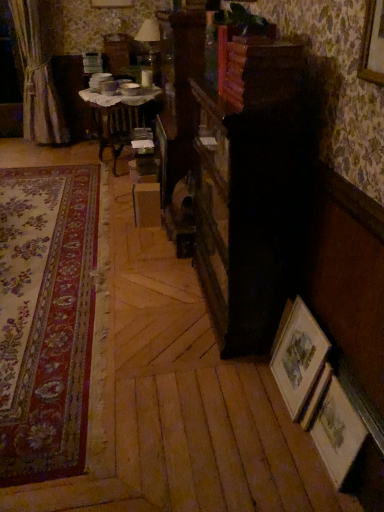
What do you see at coordinates (120, 111) in the screenshot? The height and width of the screenshot is (512, 384). I see `wooden table at center` at bounding box center [120, 111].

What do you see at coordinates (149, 44) in the screenshot?
I see `matte white lampshade at upper center` at bounding box center [149, 44].

The image size is (384, 512). Find the location of `wooden picture frame at lower right, marked as the 1th picture frame in a right-to-left arrangement`. wooden picture frame at lower right, marked as the 1th picture frame in a right-to-left arrangement is located at coordinates (337, 433).

I want to click on wooden table at center, so click(120, 111).

Consider the image. Which point is more forward, [37,111] or [94,212]?

The point [94,212] is in front.

Is silky beige curtain at left facing towards floral carpet at left?

Yes, silky beige curtain at left faces towards floral carpet at left.

Are silky beige curtain at left and floral carpet at left making contact?

No, silky beige curtain at left is not touching floral carpet at left.

Which is behind, matte white lampshade at upper center or wooden at upper center?

matte white lampshade at upper center.

I want to click on shelf below the matte white lampshade at upper center (from the image's perspective), so click(257, 68).

How distant is matte white lampshade at upper center from wooden at upper center?

They are 8.51 feet apart.

Looking at their sizes, would you say matte white lampshade at upper center is wider or thinner than wooden at upper center?

Clearly, matte white lampshade at upper center has more width compared to wooden at upper center.

Which object is positioned more to the left, wooden picture frame at lower right, marked as the 1th picture frame in a right-to-left arrangement, or silky beige curtain at left?

silky beige curtain at left is more to the left.

Is point (318, 440) farther from camera compared to point (36, 128)?

That is False.

In the scene shown: Relative to silky beige curtain at left, is wooden picture frame at lower right, marked as the 1th picture frame in a right-to-left arrangement, in front or behind?

In the image, wooden picture frame at lower right, marked as the 1th picture frame in a right-to-left arrangement, appears in front of silky beige curtain at left.

Is wooden picture frame at lower right, marked as the 1th picture frame in a right-to-left arrangement, inside or outside of matte white lampshade at upper center?

wooden picture frame at lower right, marked as the 1th picture frame in a right-to-left arrangement, is not enclosed by matte white lampshade at upper center.

From the image's perspective, would you say wooden picture frame at lower right, marked as the 1th picture frame in a right-to-left arrangement, is positioned over matte white lampshade at upper center?

No.

From the picture: From a real-world perspective, between wooden picture frame at lower right, which is the 2th picture frame in left-to-right order, and matte white lampshade at upper center, who is vertically higher?

matte white lampshade at upper center.

Between point (356, 412) and point (146, 49), which one is positioned behind?

The point (146, 49) is behind.

Is silky beige curtain at left located within wooden at upper center?

No.

Who is shorter, wooden at upper center or silky beige curtain at left?

With less height is wooden at upper center.

From the image's perspective, between wooden at upper center and silky beige curtain at left, which one is located above?

silky beige curtain at left, from the image's perspective.

Does wooden at upper center have a larger size compared to wooden table at center?

No.

Is wooden table at center completely or partially inside wooden at upper center?

No, wooden table at center is not a part of wooden at upper center.

Is wooden framed print at lower right, which appears as the 2th picture frame when viewed from the right, turned away from matte white lampshade at upper center?

No, wooden framed print at lower right, which appears as the 2th picture frame when viewed from the right, is not facing away from matte white lampshade at upper center.

From a real-world perspective, is wooden framed print at lower right, which appears as the 1th picture frame when viewed from the left, on top of matte white lampshade at upper center?

Incorrect, from a real-world perspective, wooden framed print at lower right, which appears as the 1th picture frame when viewed from the left, is lower than matte white lampshade at upper center.

Is point (303, 400) less distant than point (151, 32)?

Yes, point (303, 400) is closer to viewer.

Does wooden framed print at lower right, which appears as the 2th picture frame when viewed from the right, come in front of matte white lampshade at upper center?

Yes, wooden framed print at lower right, which appears as the 2th picture frame when viewed from the right, is closer to the camera.

I want to click on plain in front of the silky beige curtain at left, so click(x=46, y=319).

You are a GUI agent. You are given a task and a screenshot of the screen. Output one action in this format:
    pyautogui.click(x=<x>, y=<y>)
    Task: Click on the shelf positioned vertically above the matte white lampshade at upper center (from a real-world perspective)
    The width and height of the screenshot is (384, 512).
    Given the screenshot: What is the action you would take?
    pyautogui.click(x=257, y=68)

From the image, which object appears to be nearer to floral carpet at left, silky beige curtain at left or wooden picture frame at lower right, marked as the 1th picture frame in a right-to-left arrangement?

wooden picture frame at lower right, marked as the 1th picture frame in a right-to-left arrangement, lies closer to floral carpet at left than the other object.

In the scene shown: When comparing their distances from wooden picture frame at lower right, marked as the 1th picture frame in a right-to-left arrangement, does wooden table at center or wooden at upper center seem closer?

wooden at upper center.

Based on their spatial positions, is silky beige curtain at left or wooden at upper center further from matte white lampshade at upper center?

wooden at upper center.

Estimate the real-world distances between objects in this image. Which object is closer to wooden framed print at lower right, which appears as the 2th picture frame when viewed from the right, matte white lampshade at upper center or silky beige curtain at left?

matte white lampshade at upper center.

Estimate the real-world distances between objects in this image. Which object is closer to wooden picture frame at lower right, marked as the 1th picture frame in a right-to-left arrangement, floral carpet at left or wooden table at center?

Among the two, floral carpet at left is located nearer to wooden picture frame at lower right, marked as the 1th picture frame in a right-to-left arrangement.

Based on the photo, from the image, which object appears to be nearer to wooden picture frame at lower right, marked as the 1th picture frame in a right-to-left arrangement, wooden table at center or floral carpet at left?

Among the two, floral carpet at left is located nearer to wooden picture frame at lower right, marked as the 1th picture frame in a right-to-left arrangement.

From the image, which object appears to be farther from wooden picture frame at lower right, which is the 2th picture frame in left-to-right order, wooden table at center or matte white lampshade at upper center?

matte white lampshade at upper center lies further to wooden picture frame at lower right, which is the 2th picture frame in left-to-right order, than the other object.

Considering their positions, is floral carpet at left positioned closer to wooden picture frame at lower right, marked as the 1th picture frame in a right-to-left arrangement, than matte white lampshade at upper center?

floral carpet at left is positioned closer to the anchor wooden picture frame at lower right, marked as the 1th picture frame in a right-to-left arrangement.

Find the location of a particular element. This screenshot has height=512, width=384. curtain located between wooden picture frame at lower right, which is the 2th picture frame in left-to-right order, and matte white lampshade at upper center in the depth direction is located at coordinates (37, 78).

This screenshot has width=384, height=512. Identify the location of shelf located between wooden picture frame at lower right, which is the 2th picture frame in left-to-right order, and matte white lampshade at upper center in the depth direction. (257, 68).

Where is `table between wooden at upper center and silky beige curtain at left from front to back`? The image size is (384, 512). table between wooden at upper center and silky beige curtain at left from front to back is located at coordinates (120, 111).

Locate an element on the screen. This screenshot has height=512, width=384. shelf between floral carpet at left and matte white lampshade at upper center along the z-axis is located at coordinates (257, 68).